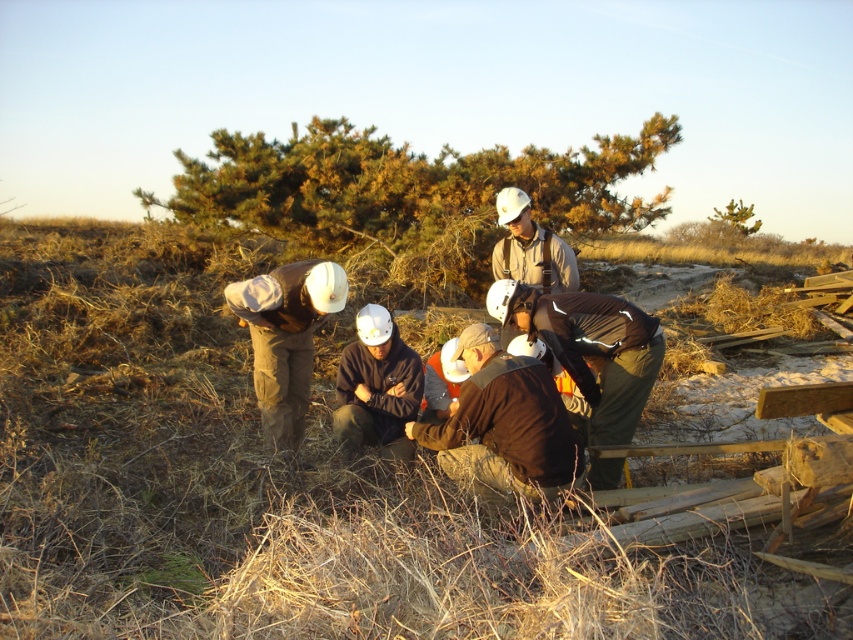
You are a worker at the construction site. You see the brown fabric at center and the dark brown jacket at center. Which one is wider?

The brown fabric at center is wider than the dark brown jacket at center.

What is the 2D coordinate of the brown fabric at center?

The brown fabric at center is located at the 2D coordinate point of (274,488).